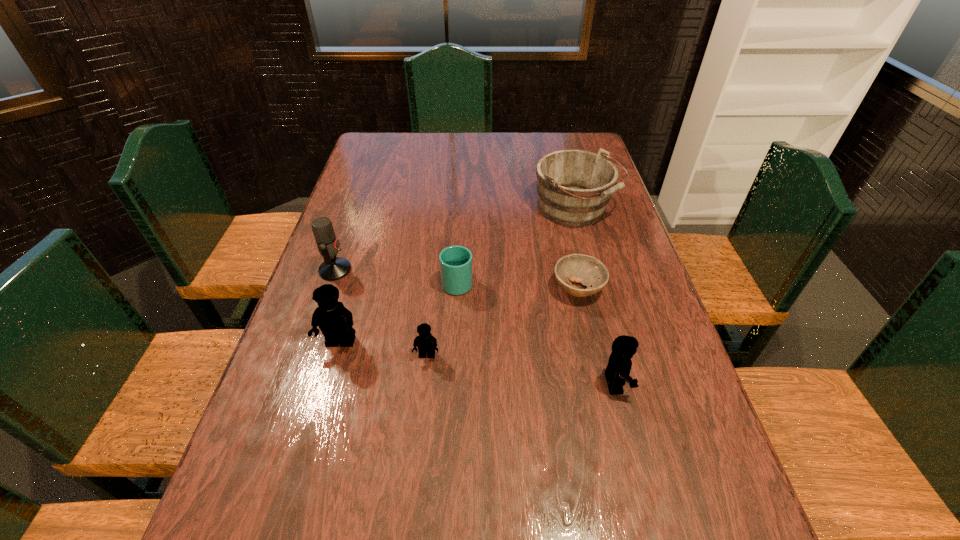
Find the location of a particular element. The height and width of the screenshot is (540, 960). vacant position for inserting another Lego evenly is located at coordinates (x=518, y=369).